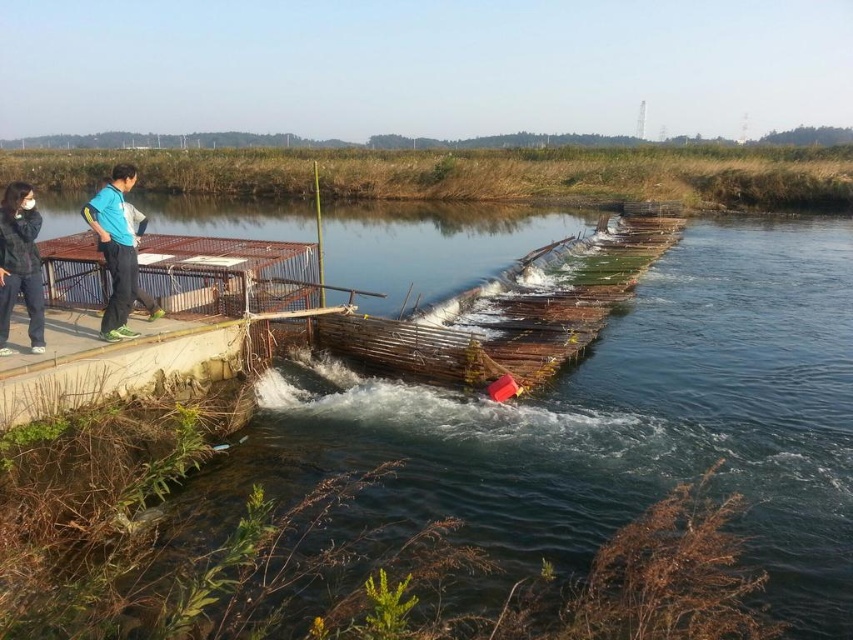
Question: Among these points, which one is farthest from the camera?

Choices:
 (A) (126, 256)
 (B) (834, 257)
 (C) (202, 307)
 (D) (107, 314)

Answer: (B)

Question: Can you confirm if wooden dock at left is wider than dark gray fleece jacket at left?

Choices:
 (A) no
 (B) yes

Answer: (A)

Question: Is wooden dock at left wider than blue fabric pants at left?

Choices:
 (A) no
 (B) yes

Answer: (A)

Question: Is dark blue fabric couple at left thinner than dark gray fleece jacket at left?

Choices:
 (A) no
 (B) yes

Answer: (A)

Question: Which object is the farthest from the wooden dock at left?

Choices:
 (A) dark gray fleece jacket at left
 (B) brown wooden river at center
 (C) dark blue fabric couple at left

Answer: (B)

Question: Which of these objects is positioned farthest from the wooden dock at left?

Choices:
 (A) dark gray fleece jacket at left
 (B) blue fabric pants at left

Answer: (A)